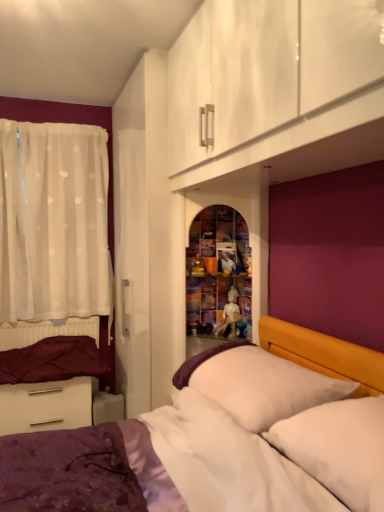
Identify the location of matte white bed frame at lower left. (49, 405).

How much space does white soft pillow at right, placed as the 2th pillow when sorted from back to front, occupy horizontally?

The width of white soft pillow at right, placed as the 2th pillow when sorted from back to front, is 16.27 inches.

This screenshot has width=384, height=512. In order to click on white soft pillow at right, placed as the 2th pillow when sorted from back to front in this screenshot , I will do `click(339, 448)`.

Locate an element on the screen. This screenshot has width=384, height=512. matte white bed frame at lower left is located at coordinates (49, 405).

Is matte white bed frame at lower left smaller than white soft pillow at center, acting as the second pillow starting from the front?

Indeed, matte white bed frame at lower left has a smaller size compared to white soft pillow at center, acting as the second pillow starting from the front.

Is matte white bed frame at lower left oriented away from white soft pillow at center, acting as the second pillow starting from the front?

matte white bed frame at lower left is not turned away from white soft pillow at center, acting as the second pillow starting from the front.

Is matte white bed frame at lower left to the left of white soft pillow at center, the 1th pillow from the back, from the viewer's perspective?

Yes.

Is there a large distance between matte white bed frame at lower left and white soft pillow at center, acting as the second pillow starting from the front?

That's right, there is a large distance between matte white bed frame at lower left and white soft pillow at center, acting as the second pillow starting from the front.

Is white sheer curtain at left located within white glossy drawer at lower left?

No, white glossy drawer at lower left does not contain white sheer curtain at left.

Considering the sizes of objects white glossy drawer at lower left and white sheer curtain at left in the image provided, who is bigger, white glossy drawer at lower left or white sheer curtain at left?

white sheer curtain at left is bigger.

Which of these two, white glossy drawer at lower left or white sheer curtain at left, stands taller?

white sheer curtain at left.

Consider the image. Does white soft pillow at center, acting as the second pillow starting from the front, have a greater height compared to white sheer curtain at left?

In fact, white soft pillow at center, acting as the second pillow starting from the front, may be shorter than white sheer curtain at left.

Considering the positions of point (297, 391) and point (12, 158), is point (297, 391) closer or farther from the camera than point (12, 158)?

Clearly, point (297, 391) is closer to the camera than point (12, 158).

Which is more to the left, white soft pillow at center, the 1th pillow from the back, or white sheer curtain at left?

From the viewer's perspective, white sheer curtain at left appears more on the left side.

From a real-world perspective, is white soft pillow at center, acting as the second pillow starting from the front, on top of white sheer curtain at left?

No, from a real-world perspective, white soft pillow at center, acting as the second pillow starting from the front, is not above white sheer curtain at left.

From a real-world perspective, relative to matte white bed frame at lower left, is white soft pillow at right, which is the first pillow from front to back, vertically above or below?

From a real-world perspective, white soft pillow at right, which is the first pillow from front to back, is physically above matte white bed frame at lower left.

Looking at this image, considering the relative sizes of white soft pillow at right, placed as the 2th pillow when sorted from back to front, and matte white bed frame at lower left in the image provided, is white soft pillow at right, placed as the 2th pillow when sorted from back to front, taller than matte white bed frame at lower left?

No.

Which object is further away from the camera taking this photo, white soft pillow at right, which is the first pillow from front to back, or matte white bed frame at lower left?

matte white bed frame at lower left is further from the camera.

Does white soft pillow at right, placed as the 2th pillow when sorted from back to front, turn towards matte white bed frame at lower left?

No, white soft pillow at right, placed as the 2th pillow when sorted from back to front, is not facing towards matte white bed frame at lower left.

Looking at their sizes, would you say white soft pillow at center, acting as the second pillow starting from the front, is wider or thinner than matte white bed frame at lower left?

In the image, white soft pillow at center, acting as the second pillow starting from the front, appears to be wider than matte white bed frame at lower left.

Looking at the image, does white soft pillow at center, acting as the second pillow starting from the front, seem bigger or smaller compared to matte white bed frame at lower left?

Considering their sizes, white soft pillow at center, acting as the second pillow starting from the front, takes up more space than matte white bed frame at lower left.

Considering their positions, is white soft pillow at center, acting as the second pillow starting from the front, located in front of or behind matte white bed frame at lower left?

white soft pillow at center, acting as the second pillow starting from the front, is in front of matte white bed frame at lower left.

From the picture: From a real-world perspective, between white soft pillow at center, the 1th pillow from the back, and matte white bed frame at lower left, who is vertically higher?

In real-world perspective, white soft pillow at center, the 1th pillow from the back, is above.

In the scene shown: From a real-world perspective, relative to white soft pillow at right, which is the first pillow from front to back, is matte white bed frame at lower left vertically above or below?

matte white bed frame at lower left is below white soft pillow at right, which is the first pillow from front to back.

Based on their sizes in the image, would you say matte white bed frame at lower left is bigger or smaller than white soft pillow at right, placed as the 2th pillow when sorted from back to front?

Clearly, matte white bed frame at lower left is smaller in size than white soft pillow at right, placed as the 2th pillow when sorted from back to front.

Between matte white bed frame at lower left and white soft pillow at right, placed as the 2th pillow when sorted from back to front, which one has more height?

matte white bed frame at lower left is taller.

How many degrees apart are the facing directions of matte white bed frame at lower left and white soft pillow at right, which is the first pillow from front to back?

There is a 89.5-degree angle between the facing directions of matte white bed frame at lower left and white soft pillow at right, which is the first pillow from front to back.

From a real-world perspective, is matte white bed frame at lower left under white sheer curtain at left?

Correct, in the physical world, matte white bed frame at lower left is lower than white sheer curtain at left.

Between matte white bed frame at lower left and white sheer curtain at left, which one appears on the right side from the viewer's perspective?

Positioned to the right is matte white bed frame at lower left.

Looking at this image, is matte white bed frame at lower left positioned beyond the bounds of white sheer curtain at left?

Yes, matte white bed frame at lower left is not within white sheer curtain at left.

In order to click on bed frame behind the white soft pillow at center, the 1th pillow from the back in this screenshot , I will do `click(49, 405)`.

You are a GUI agent. You are given a task and a screenshot of the screen. Output one action in this format:
    pyautogui.click(x=<x>, y=<y>)
    Task: Click on the curtain that appears on the right of white glossy drawer at lower left
    Image resolution: width=384 pixels, height=512 pixels.
    Given the screenshot: What is the action you would take?
    pyautogui.click(x=54, y=222)

Considering their positions, is white soft pillow at center, the 1th pillow from the back, positioned closer to white glossy drawer at lower left than white soft pillow at right, which is the first pillow from front to back?

white soft pillow at center, the 1th pillow from the back, lies closer to white glossy drawer at lower left than the other object.

From the picture: From the image, which object appears to be nearer to white soft pillow at center, the 1th pillow from the back, matte white bed frame at lower left or white sheer curtain at left?

matte white bed frame at lower left is closer to white soft pillow at center, the 1th pillow from the back.

From the image, which object appears to be nearer to white soft pillow at right, which is the first pillow from front to back, white soft pillow at center, acting as the second pillow starting from the front, or white sheer curtain at left?

white soft pillow at center, acting as the second pillow starting from the front, lies closer to white soft pillow at right, which is the first pillow from front to back, than the other object.

Considering their positions, is white soft pillow at right, which is the first pillow from front to back, positioned further to purple velvet bed at lower left than matte white bed frame at lower left?

Among the two, matte white bed frame at lower left is located further to purple velvet bed at lower left.

Based on their spatial positions, is purple velvet bed at lower left or matte white bed frame at lower left further from white glossy drawer at lower left?

purple velvet bed at lower left.

Estimate the real-world distances between objects in this image. Which object is closer to matte white bed frame at lower left, white glossy drawer at lower left or purple velvet bed at lower left?

white glossy drawer at lower left is closer to matte white bed frame at lower left.

Consider the image. Looking at the image, which one is located closer to matte white bed frame at lower left, white glossy drawer at lower left or white sheer curtain at left?

white glossy drawer at lower left is closer to matte white bed frame at lower left.

Considering their positions, is white soft pillow at right, which is the first pillow from front to back, positioned further to white glossy drawer at lower left than purple velvet bed at lower left?

Among the two, white soft pillow at right, which is the first pillow from front to back, is located further to white glossy drawer at lower left.

At what (x,y) coordinates should I click in order to perform the action: click on drawer positioned between purple velvet bed at lower left and white sheer curtain at left from near to far. Please return your answer as a coordinate pair (x, y). Image resolution: width=384 pixels, height=512 pixels. Looking at the image, I should click on (45, 406).

Identify the location of curtain located between white soft pillow at right, which is the first pillow from front to back, and matte white bed frame at lower left in the depth direction. This screenshot has height=512, width=384. (54, 222).

In order to click on drawer between white soft pillow at center, acting as the second pillow starting from the front, and matte white bed frame at lower left, along the z-axis in this screenshot , I will do click(45, 406).

Identify the location of curtain located between purple velvet bed at lower left and matte white bed frame at lower left in the depth direction. (54, 222).